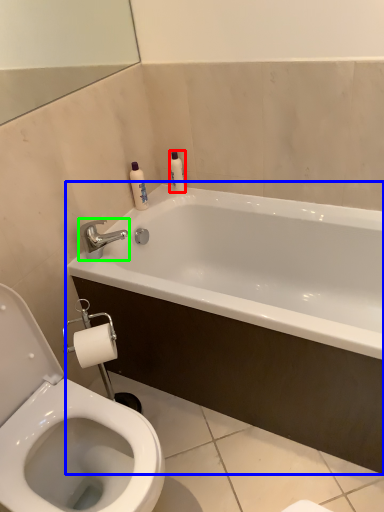
Question: Which object is positioned farthest from toiletry (highlighted by a red box)? Select from bathtub (highlighted by a blue box) and tap (highlighted by a green box).

Choices:
 (A) bathtub
 (B) tap

Answer: (A)